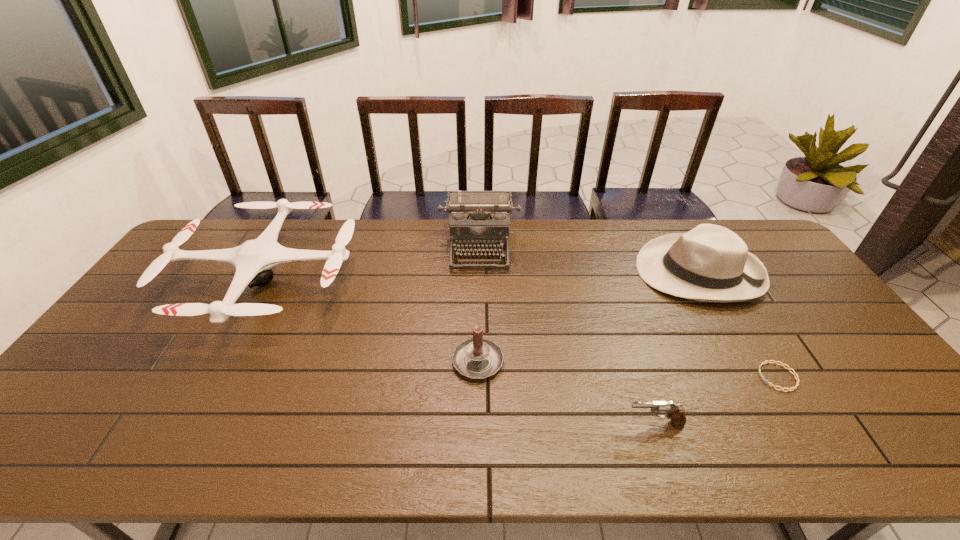
Where is `typewriter`? typewriter is located at coordinates (479, 221).

Find the location of `fedora`. fedora is located at coordinates (710, 263).

Where is `drone`? The width and height of the screenshot is (960, 540). drone is located at coordinates (253, 260).

Find the location of a particular element. candle is located at coordinates (476, 358).

Identify the location of the fifth tallest object. The width and height of the screenshot is (960, 540). (676, 413).

In order to click on the fourth object from left to right in this screenshot , I will do `click(676, 413)`.

I want to click on the shortest object, so click(767, 361).

The width and height of the screenshot is (960, 540). What are the coordinates of `free region located on the typing side of the typewriter` in the screenshot? It's located at (479, 317).

What are the coordinates of `vacant space positioned 0.060m on the front-facing side of the fedora` in the screenshot? It's located at (619, 272).

This screenshot has width=960, height=540. Find the location of `vacant point located 0.290m on the front-facing side of the fedora`. vacant point located 0.290m on the front-facing side of the fedora is located at coordinates (548, 272).